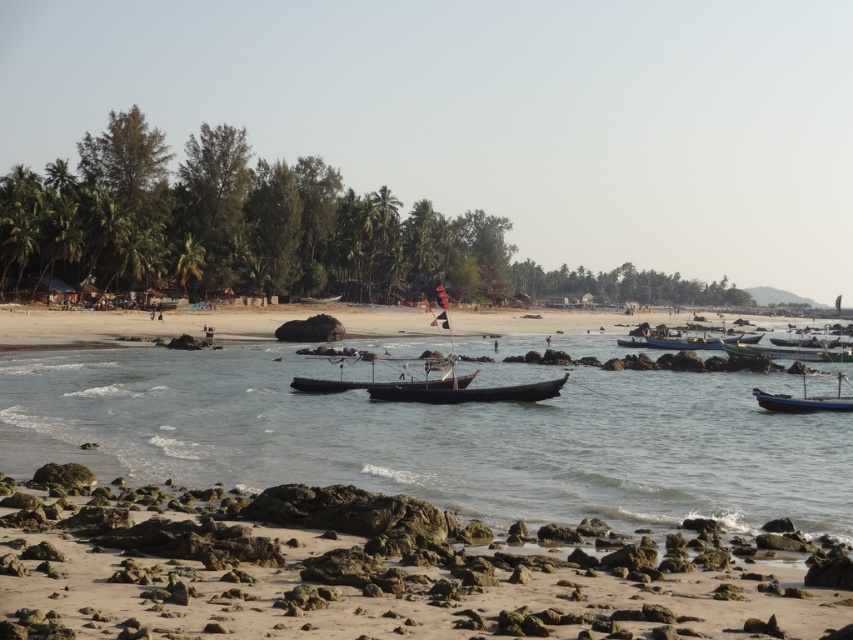
Is smooth sand beach at center to the left of green wooden boat at right from the viewer's perspective?

Correct, you'll find smooth sand beach at center to the left of green wooden boat at right.

Can you confirm if smooth sand beach at center is positioned below green wooden boat at right?

No, smooth sand beach at center is not below green wooden boat at right.

Is point (317, 305) behind point (819, 349)?

Yes, point (317, 305) is behind point (819, 349).

Find the location of a particular element. smooth sand beach at center is located at coordinates (194, 323).

Can you confirm if smooth sand beach at center is bigger than wooden boat at center?

Yes, smooth sand beach at center is bigger than wooden boat at center.

This screenshot has width=853, height=640. What are the coordinates of `smooth sand beach at center` in the screenshot? It's located at (194, 323).

Locate an element on the screen. smooth sand beach at center is located at coordinates (194, 323).

Can you confirm if dark brown wooden canoe at center is wider than wooden boat at center?

No, dark brown wooden canoe at center is not wider than wooden boat at center.

Is dark brown wooden canoe at center bigger than wooden boat at center?

Answer: No, dark brown wooden canoe at center is not bigger than wooden boat at center.

Find the location of a particular element. Image resolution: width=853 pixels, height=640 pixels. dark brown wooden canoe at center is located at coordinates (467, 392).